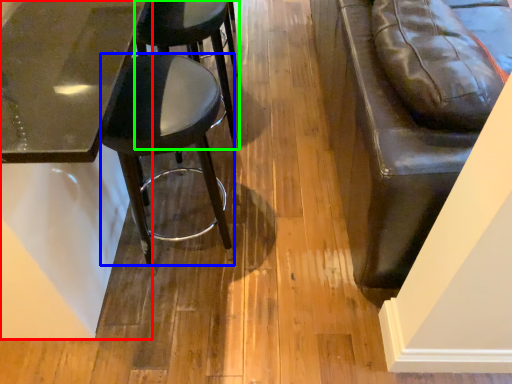
Question: Which is farther away from table (highlighted by a red box)? stool (highlighted by a blue box) or stool (highlighted by a green box)?

Choices:
 (A) stool
 (B) stool

Answer: (B)